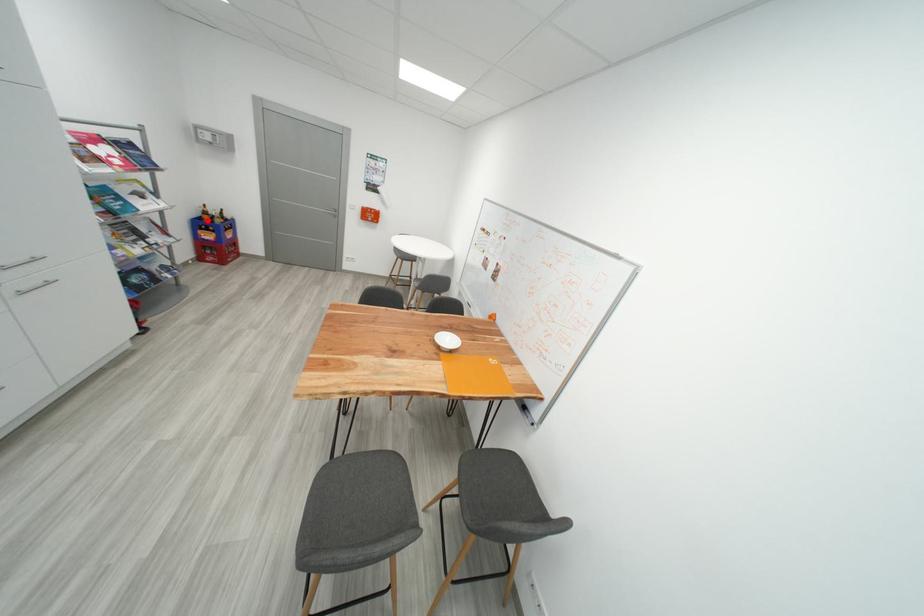
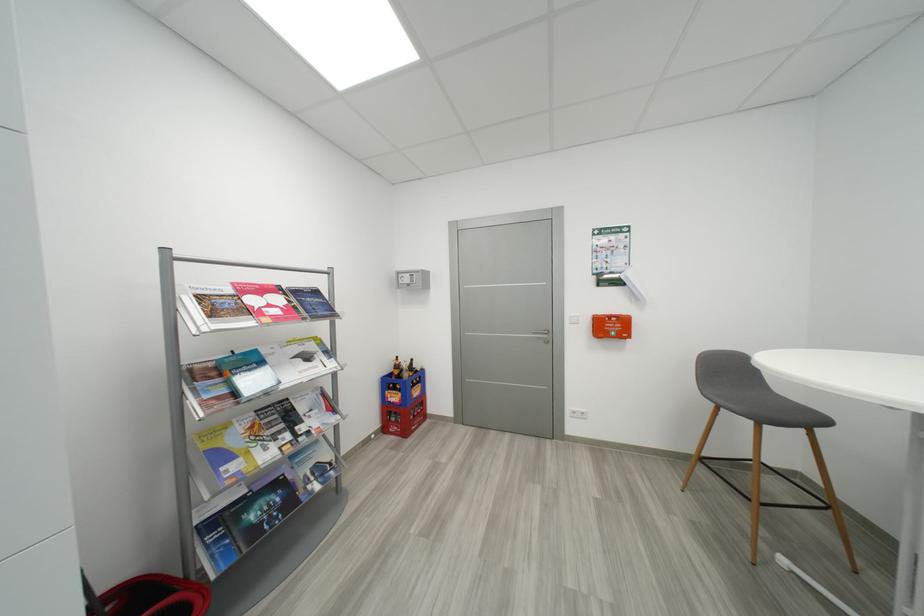
The point at the highlighted location is marked in the first image. Where is the corresponding point in the second image?

(397, 377)